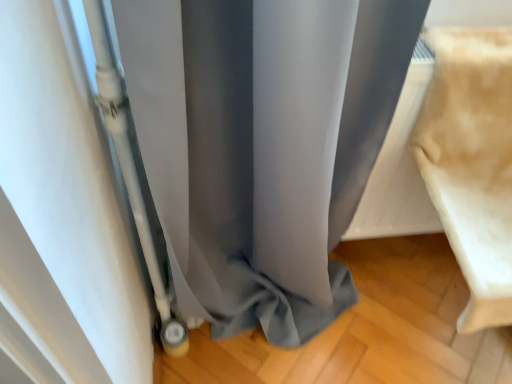
Question: Relative to matte gray curtain at center, is beige fabric cushion at right in front or behind?

Choices:
 (A) front
 (B) behind

Answer: (B)

Question: Considering the positions of point (460, 158) and point (398, 52), is point (460, 158) closer or farther from the camera than point (398, 52)?

Choices:
 (A) farther
 (B) closer

Answer: (A)

Question: From a real-world perspective, is beige fabric cushion at right physically located above or below matte gray curtain at center?

Choices:
 (A) below
 (B) above

Answer: (B)

Question: In terms of width, does matte gray curtain at center look wider or thinner when compared to beige fabric cushion at right?

Choices:
 (A) wide
 (B) thin

Answer: (B)

Question: From the image's perspective, is matte gray curtain at center located above or below beige fabric cushion at right?

Choices:
 (A) above
 (B) below

Answer: (B)

Question: In the image, is matte gray curtain at center positioned in front of or behind beige fabric cushion at right?

Choices:
 (A) behind
 (B) front

Answer: (B)

Question: From a real-world perspective, is matte gray curtain at center positioned above or below beige fabric cushion at right?

Choices:
 (A) above
 (B) below

Answer: (B)